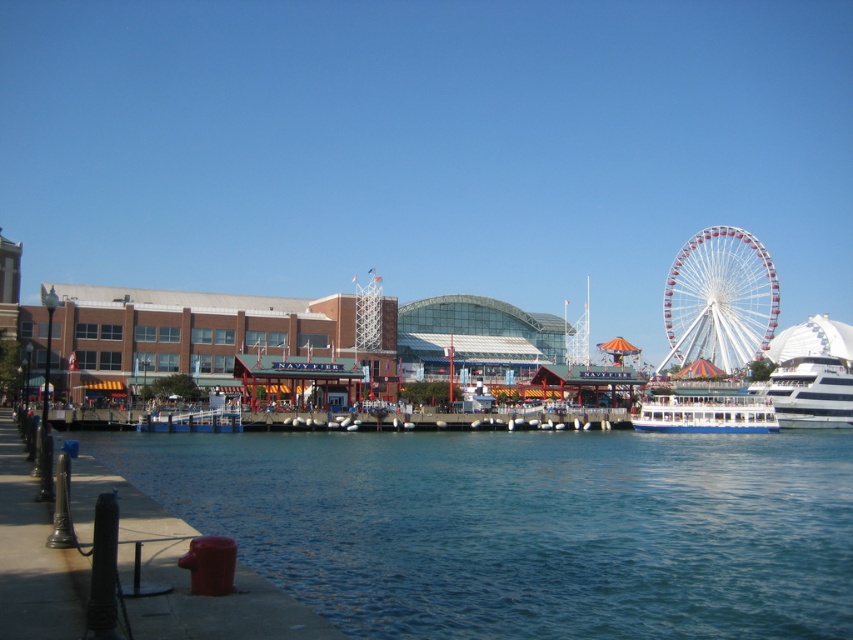
Question: Is the position of white metallic ferris wheel at right more distant than that of white glossy yacht at right?

Choices:
 (A) no
 (B) yes

Answer: (B)

Question: Which point appears farthest from the camera in this image?

Choices:
 (A) (805, 358)
 (B) (692, 336)
 (C) (770, 403)

Answer: (B)

Question: Which point is closer to the camera?

Choices:
 (A) (795, 401)
 (B) (740, 595)

Answer: (B)

Question: Does white glossy yacht at right appear on the left side of white glossy boat at lower center?

Choices:
 (A) no
 (B) yes

Answer: (A)

Question: Which of the following is the farthest from the observer?

Choices:
 (A) white glossy boat at lower center
 (B) white metallic ferris wheel at right
 (C) white glossy yacht at right
 (D) clear blue water at lower center

Answer: (B)

Question: Is white metallic ferris wheel at right to the left of white glossy yacht at right from the viewer's perspective?

Choices:
 (A) no
 (B) yes

Answer: (B)